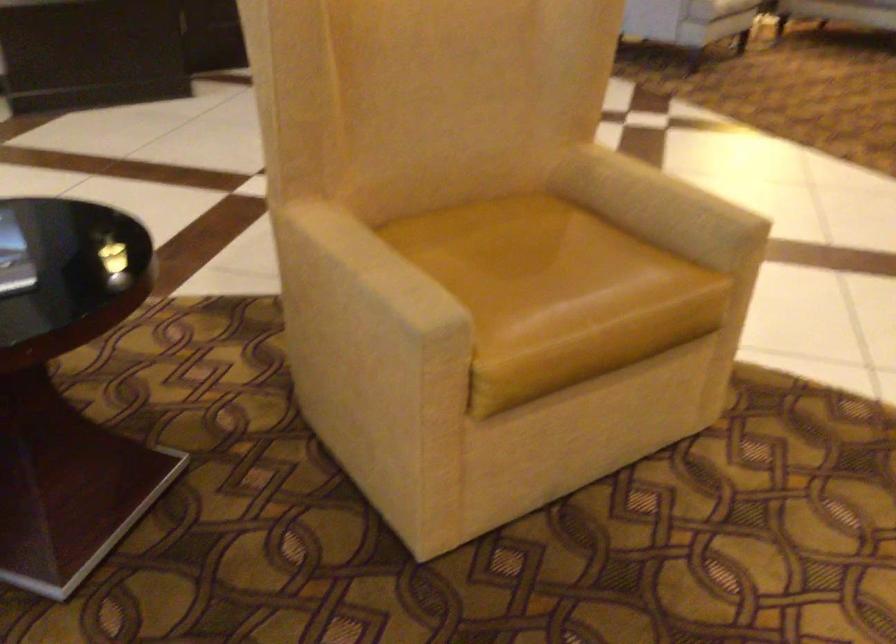
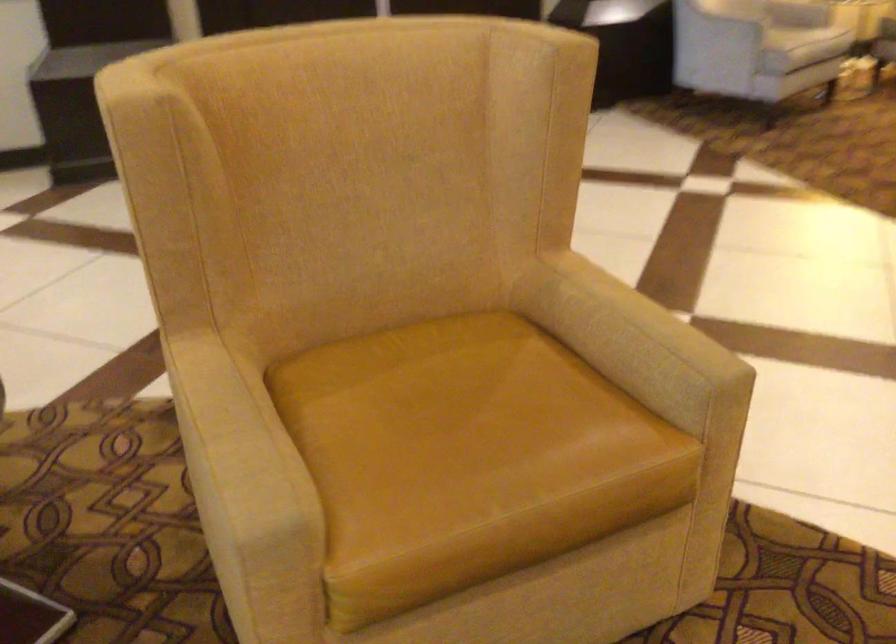
In the second image, find the point that corresponds to (x=376, y=266) in the first image.

(235, 435)